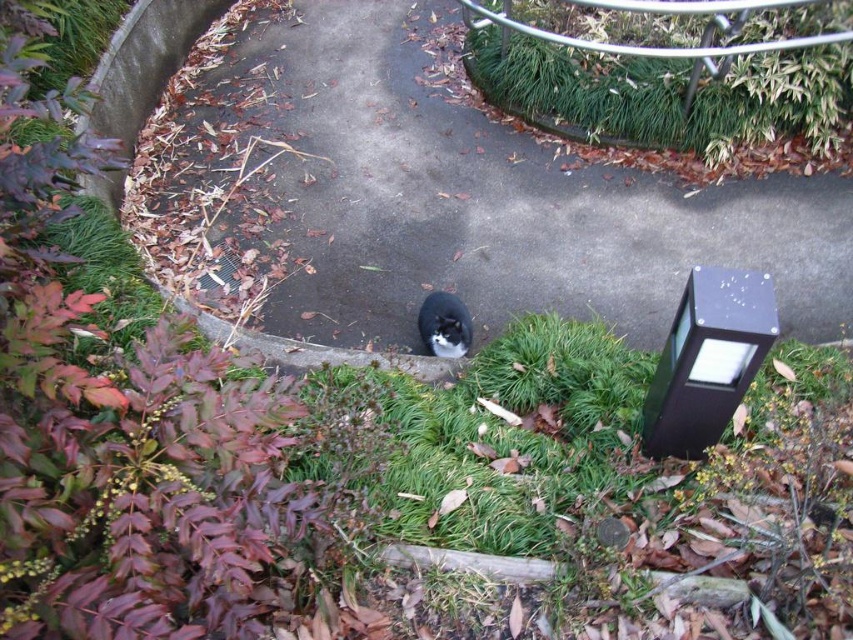
You are a photographer trying to capture both the leaves at lower left and the black fur cat at center in a single frame. Given that your camera has a 1.5 meter focal length, will you be able to include both subjects in the shot without moving either?

The leaves at lower left and black fur cat at center are 1.37 meters apart, which is within the camera focal length of 1.5 meters. Therefore, you can capture both subjects in a single frame without moving them.

You are a photographer standing at the end of the pathway. You want to take a picture of the black fur cat at center and the leaves at lower left in the same frame. Which object should you position closer to the left side of your camera viewfinder to include both in the shot?

The leaves at lower left are already positioned on the left side of the black fur cat at center, so you should keep the leaves at lower left on the left side of the viewfinder and the black fur cat at center on the right to capture both in the frame.